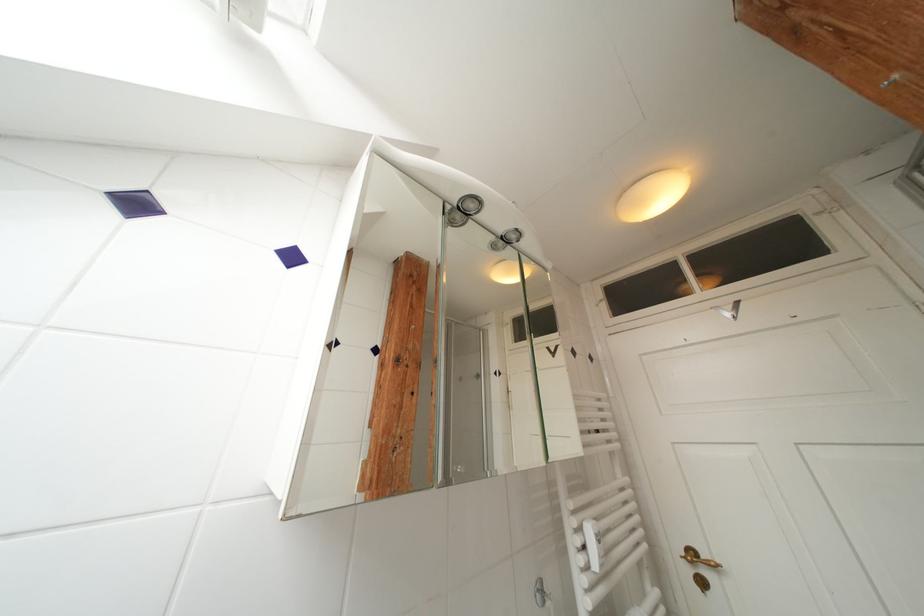
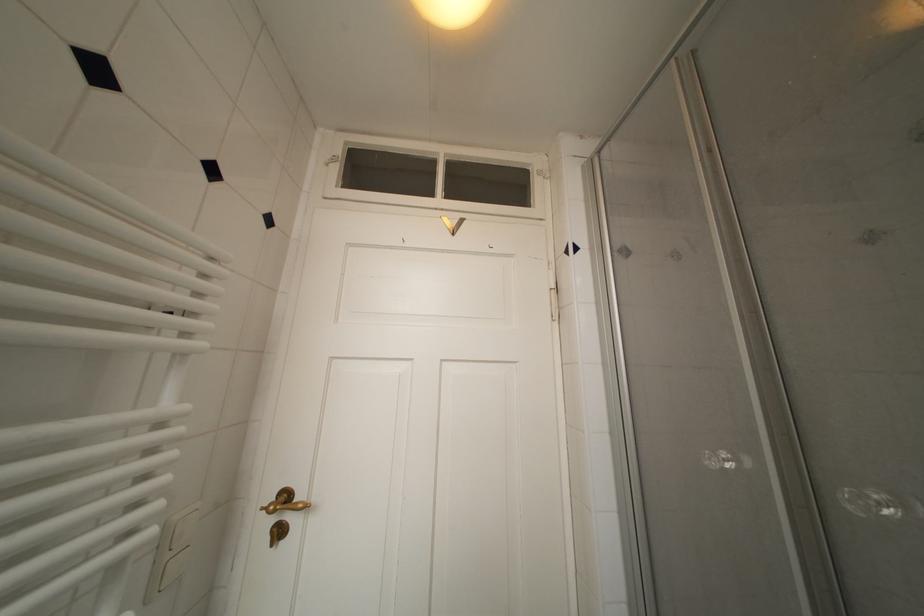
Question: Based on the continuous images, in which direction is the camera rotating? Reply with the corresponding letter.

Choices:
 (A) Left
 (B) Right
 (C) Up
 (D) Down

Answer: (B)